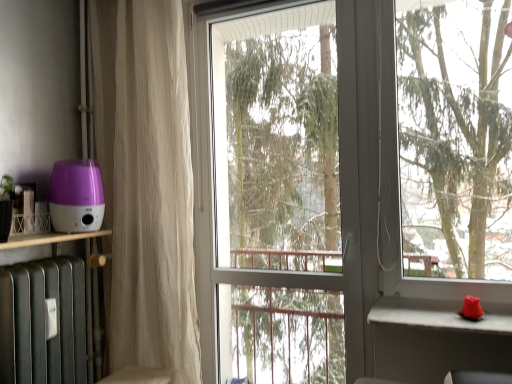
Question: From a real-world perspective, is white sheer curtain at left positioned above or below purple plastic humidifier at left?

Choices:
 (A) above
 (B) below

Answer: (A)

Question: Is white sheer curtain at left wider or thinner than purple plastic humidifier at left?

Choices:
 (A) thin
 (B) wide

Answer: (A)

Question: Considering the real-world distances, which object is closest to the purple plastic humidifier at left?

Choices:
 (A) transparent glass screen door at center
 (B) white concrete window sill at right
 (C) white sheer curtain at left

Answer: (C)

Question: Which object is the closest to the transparent glass screen door at center?

Choices:
 (A) purple plastic humidifier at left
 (B) white sheer curtain at left
 (C) white concrete window sill at right

Answer: (B)